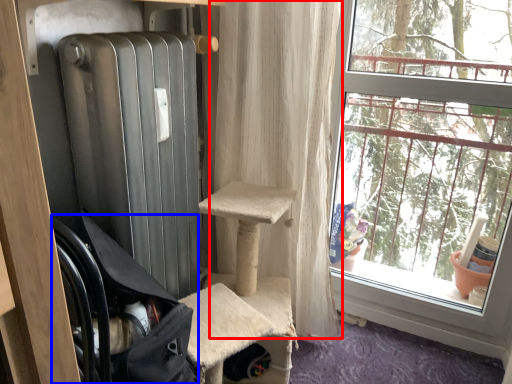
Question: Which of the following is the closest to the observer, curtain (highlighted by a red box) or chair (highlighted by a blue box)?

Choices:
 (A) curtain
 (B) chair

Answer: (B)